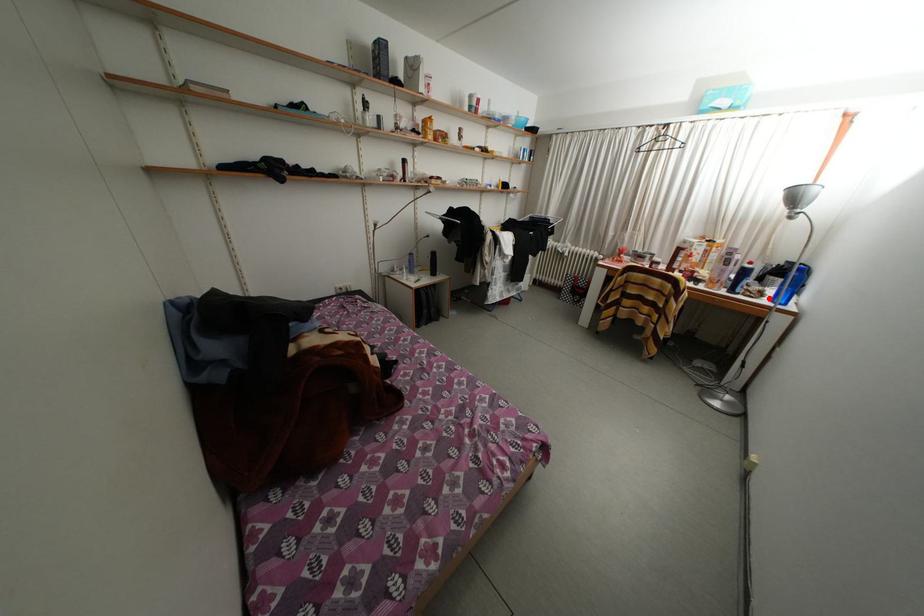
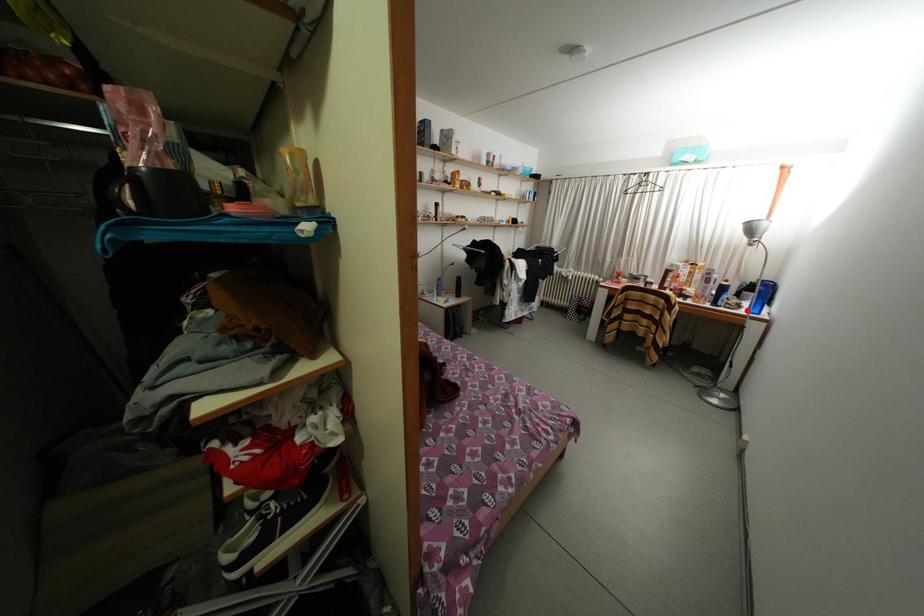
In the scene shown: I am providing you with two images of the same scene from different viewpoints. A red point is marked on the first image and another point is marked on the second image. Is the marked point in image1 the same physical position as the marked point in image2?

Yes